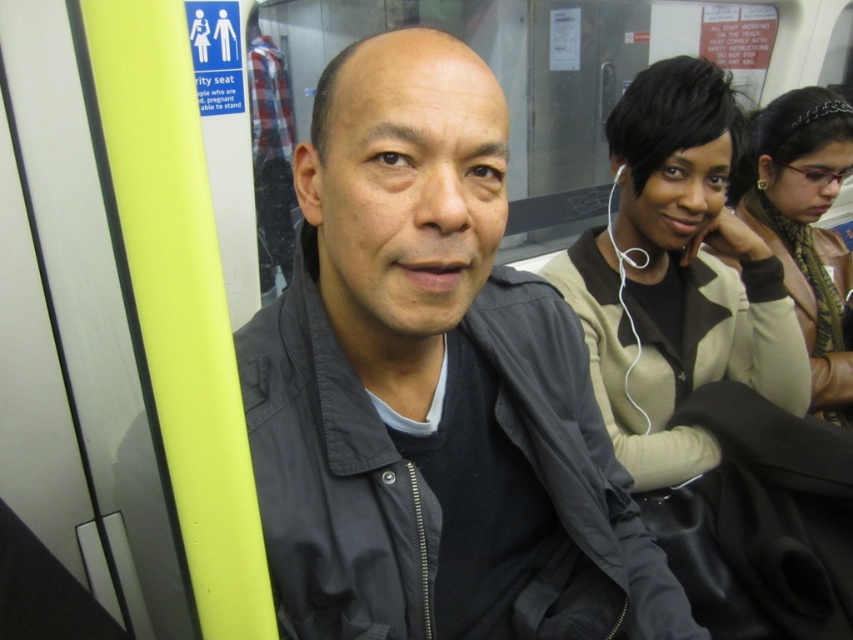
You are a photographer standing in the subway car and want to take a photo of the dark gray jacket at center and the beige fabric jacket at center. Which jacket is closer to the camera?

The dark gray jacket at center is positioned under the beige fabric jacket at center, meaning the beige fabric jacket at center is closer to the camera.

You are standing in the train car and want to place a small item exactly at the point marked as point (424, 368). Which object is this point located on?

The point (424, 368) is located on the dark gray jacket at center.